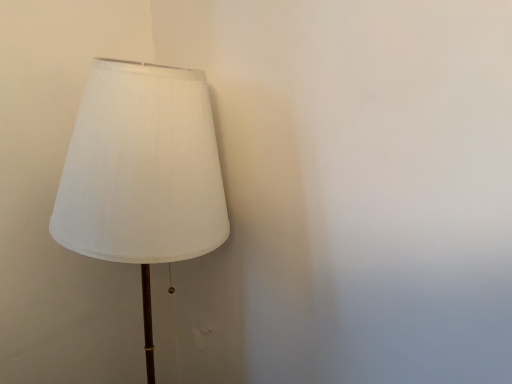
Where is `white fabric lampshade at left`? The height and width of the screenshot is (384, 512). white fabric lampshade at left is located at coordinates (142, 173).

What is the approximate width of white fabric lampshade at left?

It is 16.96 inches.

What do you see at coordinates (142, 173) in the screenshot? The image size is (512, 384). I see `white fabric lampshade at left` at bounding box center [142, 173].

Find the location of a particular element. white fabric lampshade at left is located at coordinates (142, 173).